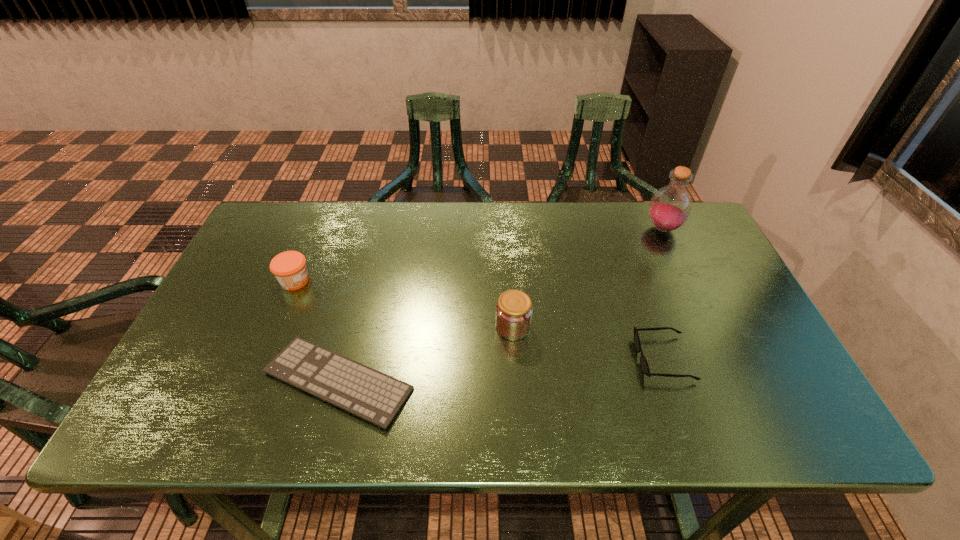
Locate an element on the screen. This screenshot has width=960, height=540. vacant space that's between the farther jam and the rightmost object is located at coordinates (479, 255).

This screenshot has width=960, height=540. I want to click on free space that is in between the fourth object from left to right and the taller jam, so click(x=588, y=342).

Locate an element on the screen. The image size is (960, 540). vacant area that lies between the fourth object from left to right and the right jam is located at coordinates (588, 342).

Image resolution: width=960 pixels, height=540 pixels. I want to click on vacant space in between the tallest object and the sunglasses, so click(x=663, y=293).

Locate an element on the screen. This screenshot has height=540, width=960. unoccupied position between the rightmost object and the left jam is located at coordinates (479, 255).

Where is `object that stands as the fourth closest to the second shortest object`? object that stands as the fourth closest to the second shortest object is located at coordinates (289, 267).

In order to click on object that is the fourth closest one to the left jam in this screenshot , I will do `click(670, 207)`.

The height and width of the screenshot is (540, 960). I want to click on vacant space that satisfies the following two spatial constraints: 1. on the front side of the tallest object; 2. on the front label of the left jam, so click(686, 281).

Identify the location of vacant area in the image that satisfies the following two spatial constraints: 1. on the front label of the shortest object; 2. on the right side of the farther jam. (253, 381).

Locate an element on the screen. vacant point that satisfies the following two spatial constraints: 1. on the back side of the shortest object; 2. on the left side of the bottle is located at coordinates (378, 228).